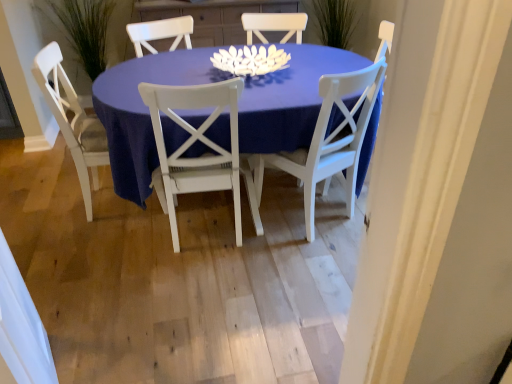
What do you see at coordinates (72, 121) in the screenshot? I see `white wood chair at left, which is counted as the third chair, starting from the right` at bounding box center [72, 121].

Describe the element at coordinates (323, 145) in the screenshot. Image resolution: width=512 pixels, height=384 pixels. I see `white painted wood chair at center, positioned as the third chair in left-to-right order` at that location.

What are the coordinates of `white painted wood chair at center, the 1th chair in the right-to-left sequence` in the screenshot? It's located at (323, 145).

Describe the element at coordinates (83, 29) in the screenshot. The height and width of the screenshot is (384, 512). I see `green grass at left` at that location.

Locate an element on the screen. The image size is (512, 384). white wood chair at left, which is the first chair in left-to-right order is located at coordinates (72, 121).

How much distance is there between white painted wood chair at center, the 1th chair in the right-to-left sequence, and white wood chair at center, positioned as the 2th chair in right-to-left order?

13.81 inches.

From the image's perspective, is white painted wood chair at center, the 1th chair in the right-to-left sequence, below white wood chair at center, positioned as the 2th chair in right-to-left order?

No, from the image's perspective, white painted wood chair at center, the 1th chair in the right-to-left sequence, is not below white wood chair at center, positioned as the 2th chair in right-to-left order.

Is white wood chair at center, positioned as the 2th chair in right-to-left order, at the back of white painted wood chair at center, the 1th chair in the right-to-left sequence?

No, white painted wood chair at center, the 1th chair in the right-to-left sequence, is not facing the opposite direction of white wood chair at center, positioned as the 2th chair in right-to-left order.

Is point (327, 136) more distant than point (215, 143)?

Yes, point (327, 136) is behind point (215, 143).

From a real-world perspective, is white wood chair at center, positioned as the 2th chair in right-to-left order, above or below white wood chair at left, which is the first chair in left-to-right order?

white wood chair at center, positioned as the 2th chair in right-to-left order, is situated lower than white wood chair at left, which is the first chair in left-to-right order, in the real world.

This screenshot has height=384, width=512. I want to click on the 2nd chair behind the white wood chair at center, positioned as the 2th chair in right-to-left order, counting from the anchor's position, so click(x=72, y=121).

From the image's perspective, would you say white wood chair at center, positioned as the 2th chair in right-to-left order, is shown under white wood chair at left, which is the first chair in left-to-right order?

Yes.

Is white wood chair at center, placed as the second chair when sorted from left to right, inside or outside of white wood chair at left, which is the first chair in left-to-right order?

white wood chair at center, placed as the second chair when sorted from left to right, exists outside the volume of white wood chair at left, which is the first chair in left-to-right order.

Between white wood chair at left, which is the first chair in left-to-right order, and matte white table at center, which one has smaller width?

white wood chair at left, which is the first chair in left-to-right order.

Does point (50, 108) appear closer or farther from the camera than point (123, 98)?

Point (50, 108) is farther from the camera than point (123, 98).

Relative to matte white table at center, is white wood chair at left, which is the first chair in left-to-right order, in front or behind?

In the image, white wood chair at left, which is the first chair in left-to-right order, appears behind matte white table at center.

Based on their positions, is white wood chair at center, positioned as the 2th chair in right-to-left order, located to the left or right of white painted wood chair at center, positioned as the third chair in left-to-right order?

white wood chair at center, positioned as the 2th chair in right-to-left order, is to the left of white painted wood chair at center, positioned as the third chair in left-to-right order.

From the image's perspective, is white wood chair at center, positioned as the 2th chair in right-to-left order, beneath white painted wood chair at center, positioned as the third chair in left-to-right order?

Yes, from the image's perspective, white wood chair at center, positioned as the 2th chair in right-to-left order, is beneath white painted wood chair at center, positioned as the third chair in left-to-right order.

Is white wood chair at center, positioned as the 2th chair in right-to-left order, aimed at white painted wood chair at center, the 1th chair in the right-to-left sequence?

No, white wood chair at center, positioned as the 2th chair in right-to-left order, is not facing towards white painted wood chair at center, the 1th chair in the right-to-left sequence.

Which of these two, white wood chair at center, placed as the second chair when sorted from left to right, or white painted wood chair at center, positioned as the third chair in left-to-right order, stands taller?

white painted wood chair at center, positioned as the third chair in left-to-right order, is taller.

From the image's perspective, does green grass at left appear higher than matte white table at center?

Yes, from the image's perspective, green grass at left is over matte white table at center.

In the scene shown: Are green grass at left and matte white table at center far apart?

Absolutely, green grass at left is distant from matte white table at center.

Is green grass at left not inside matte white table at center?

Yes.

Considering the sizes of objects matte white table at center and white wood chair at center, placed as the second chair when sorted from left to right, in the image provided, who is thinner, matte white table at center or white wood chair at center, placed as the second chair when sorted from left to right,?

white wood chair at center, placed as the second chair when sorted from left to right, is thinner.

Is matte white table at center not within white wood chair at center, placed as the second chair when sorted from left to right?

Yes, matte white table at center is not within white wood chair at center, placed as the second chair when sorted from left to right.

Considering the relative sizes of matte white table at center and white wood chair at center, placed as the second chair when sorted from left to right, in the image provided, is matte white table at center bigger than white wood chair at center, placed as the second chair when sorted from left to right,?

Yes.

Is matte white table at center facing towards white wood chair at center, positioned as the 2th chair in right-to-left order?

No, matte white table at center is not aimed at white wood chair at center, positioned as the 2th chair in right-to-left order.

Consider the image. From a real-world perspective, is matte white table at center above or below white wood chair at left, which is the first chair in left-to-right order?

matte white table at center is situated lower than white wood chair at left, which is the first chair in left-to-right order, in the real world.

Is matte white table at center bigger than white wood chair at left, which is the first chair in left-to-right order?

Correct, matte white table at center is larger in size than white wood chair at left, which is the first chair in left-to-right order.

Where is `kitchen & dining room table on the right of white wood chair at left, which is counted as the third chair, starting from the right`? This screenshot has height=384, width=512. kitchen & dining room table on the right of white wood chair at left, which is counted as the third chair, starting from the right is located at coordinates (143, 112).

Does point (242, 123) lie in front of point (45, 84)?

Yes, point (242, 123) is closer to viewer.

This screenshot has width=512, height=384. In order to click on the 1st chair counting from the left side of the white painted wood chair at center, the 1th chair in the right-to-left sequence in this screenshot , I will do `click(200, 156)`.

There is a white wood chair at center, positioned as the 2th chair in right-to-left order. Where is `the 1st chair above it (from a real-world perspective)`? The width and height of the screenshot is (512, 384). the 1st chair above it (from a real-world perspective) is located at coordinates (72, 121).

Estimate the real-world distances between objects in this image. Which object is further from white wood chair at left, which is the first chair in left-to-right order, white wood chair at center, positioned as the 2th chair in right-to-left order, or matte white table at center?

white wood chair at center, positioned as the 2th chair in right-to-left order, is positioned further to the anchor white wood chair at left, which is the first chair in left-to-right order.

From the image, which object appears to be nearer to matte white table at center, green grass at left or white painted wood chair at center, positioned as the third chair in left-to-right order?

Based on the image, white painted wood chair at center, positioned as the third chair in left-to-right order, appears to be nearer to matte white table at center.

Which object lies nearer to the anchor point green grass at left, matte white table at center or white painted wood chair at center, the 1th chair in the right-to-left sequence?

Among the two, matte white table at center is located nearer to green grass at left.

Which object lies further to the anchor point green grass at left, white wood chair at left, which is the first chair in left-to-right order, or white painted wood chair at center, positioned as the third chair in left-to-right order?

white painted wood chair at center, positioned as the third chair in left-to-right order, is positioned further to the anchor green grass at left.

Estimate the real-world distances between objects in this image. Which object is further from green grass at left, white wood chair at left, which is counted as the third chair, starting from the right, or white wood chair at center, placed as the second chair when sorted from left to right?

white wood chair at center, placed as the second chair when sorted from left to right.

Estimate the real-world distances between objects in this image. Which object is further from white wood chair at center, positioned as the 2th chair in right-to-left order, green grass at left or matte white table at center?

Based on the image, green grass at left appears to be further to white wood chair at center, positioned as the 2th chair in right-to-left order.

Estimate the real-world distances between objects in this image. Which object is closer to white wood chair at center, positioned as the 2th chair in right-to-left order, green grass at left or white painted wood chair at center, positioned as the third chair in left-to-right order?

white painted wood chair at center, positioned as the third chair in left-to-right order, lies closer to white wood chair at center, positioned as the 2th chair in right-to-left order, than the other object.

Considering their positions, is matte white table at center positioned closer to white wood chair at center, placed as the second chair when sorted from left to right, than white painted wood chair at center, positioned as the third chair in left-to-right order?

matte white table at center.

What are the coordinates of `kitchen & dining room table between white wood chair at center, placed as the second chair when sorted from left to right, and white painted wood chair at center, the 1th chair in the right-to-left sequence, in the horizontal direction` in the screenshot? It's located at click(143, 112).

Find the location of a particular element. Image resolution: width=512 pixels, height=384 pixels. kitchen & dining room table between green grass at left and white painted wood chair at center, the 1th chair in the right-to-left sequence is located at coordinates (143, 112).

Locate an element on the screen. The height and width of the screenshot is (384, 512). chair between white wood chair at left, which is counted as the third chair, starting from the right, and matte white table at center, in the horizontal direction is located at coordinates (200, 156).

Locate an element on the screen. chair between white wood chair at left, which is counted as the third chair, starting from the right, and white painted wood chair at center, positioned as the third chair in left-to-right order is located at coordinates (200, 156).